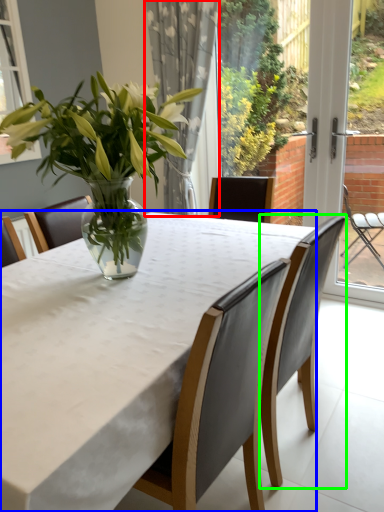
Question: Estimate the real-world distances between objects in this image. Which object is closer to curtain (highlighted by a red box), table (highlighted by a blue box) or chair (highlighted by a green box)?

Choices:
 (A) table
 (B) chair

Answer: (B)